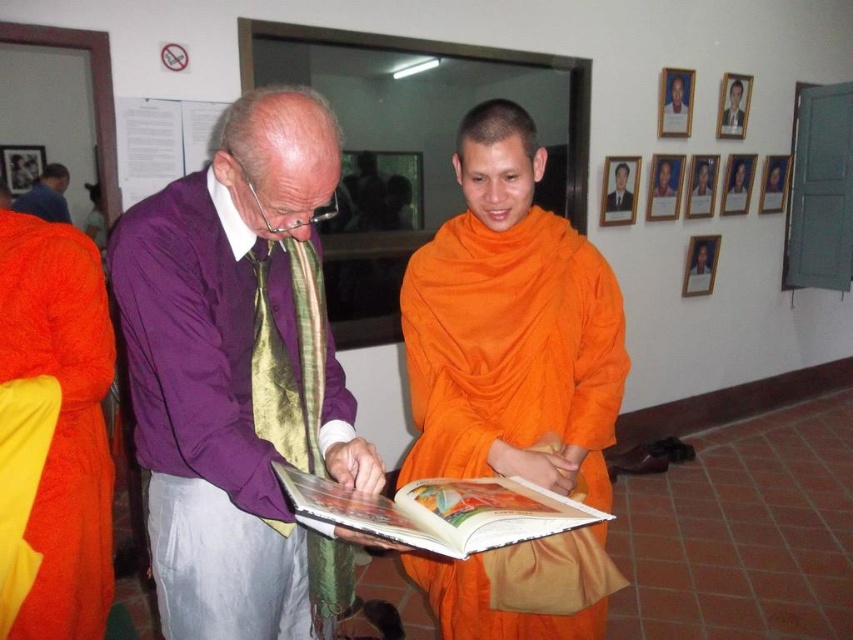
Question: Is orange silk robe at center wider than purple silk tie at center?

Choices:
 (A) no
 (B) yes

Answer: (B)

Question: Which of the following is the closest to the observer?

Choices:
 (A) orange silk robe at left
 (B) purple silk tie at center

Answer: (A)

Question: Can you confirm if orange silk robe at left is bigger than purple silk tie at center?

Choices:
 (A) yes
 (B) no

Answer: (B)

Question: Which is farther from the purple silk tie at center?

Choices:
 (A) purple silk shirt at center
 (B) orange silk robe at center
 (C) orange cloth book at center
 (D) orange cloth at center

Answer: (C)

Question: Does orange silk robe at left come in front of orange cloth at center?

Choices:
 (A) yes
 (B) no

Answer: (A)

Question: Which of the following is the closest to the observer?

Choices:
 (A) orange silk robe at left
 (B) orange cloth at center
 (C) orange cloth book at center
 (D) purple silk shirt at center

Answer: (C)